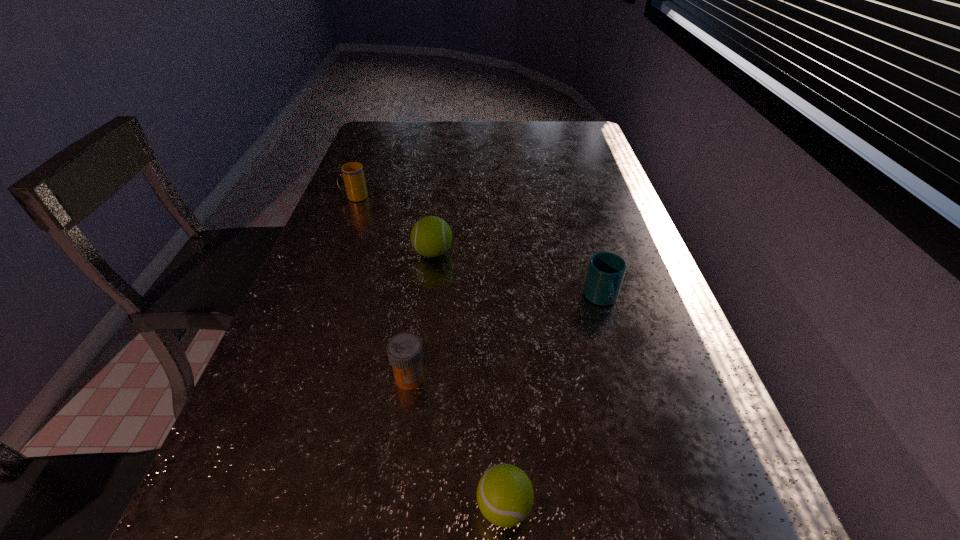
Where is `free space located on the handle side of the rightmost object`? The image size is (960, 540). free space located on the handle side of the rightmost object is located at coordinates click(651, 470).

I want to click on vacant area situated 0.180m on the label side of the medicine, so click(394, 490).

This screenshot has height=540, width=960. Find the location of `blank space located 0.080m on the right of the nearest object`. blank space located 0.080m on the right of the nearest object is located at coordinates (585, 507).

You are a GUI agent. You are given a task and a screenshot of the screen. Output one action in this format:
    pyautogui.click(x=<x>, y=<y>)
    Task: Click on the object present at the left edge
    Image resolution: width=960 pixels, height=540 pixels.
    Given the screenshot: What is the action you would take?
    pyautogui.click(x=355, y=186)

Find the location of a particular element. The width and height of the screenshot is (960, 540). object located at the right edge is located at coordinates (606, 270).

Where is `vacant space at the far edge of the desktop`? Image resolution: width=960 pixels, height=540 pixels. vacant space at the far edge of the desktop is located at coordinates (543, 123).

Find the location of `free space at the left edge`. free space at the left edge is located at coordinates (358, 203).

Locate an element on the screen. This screenshot has height=540, width=960. free location at the right edge is located at coordinates point(579,155).

At what (x,y) coordinates should I click in order to perform the action: click on vacant space at the far right corner of the desktop. Please return your answer as a coordinate pair (x, y). The height and width of the screenshot is (540, 960). Looking at the image, I should click on (592, 141).

The width and height of the screenshot is (960, 540). In order to click on free space between the second object from right to left and the medicine in this screenshot , I will do `click(457, 442)`.